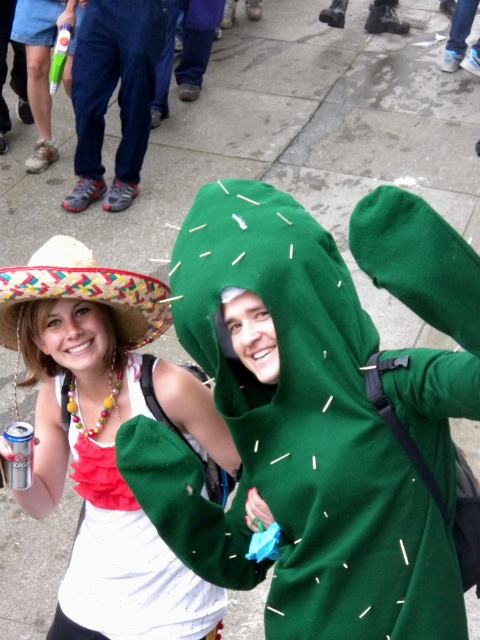
You are a photographer trying to capture the matte white tank top at center in the image. Based on the coordinates provided, where should you focus your camera lens?

The matte white tank top at center is located at coordinates point [97,442], so you should focus your camera lens there.